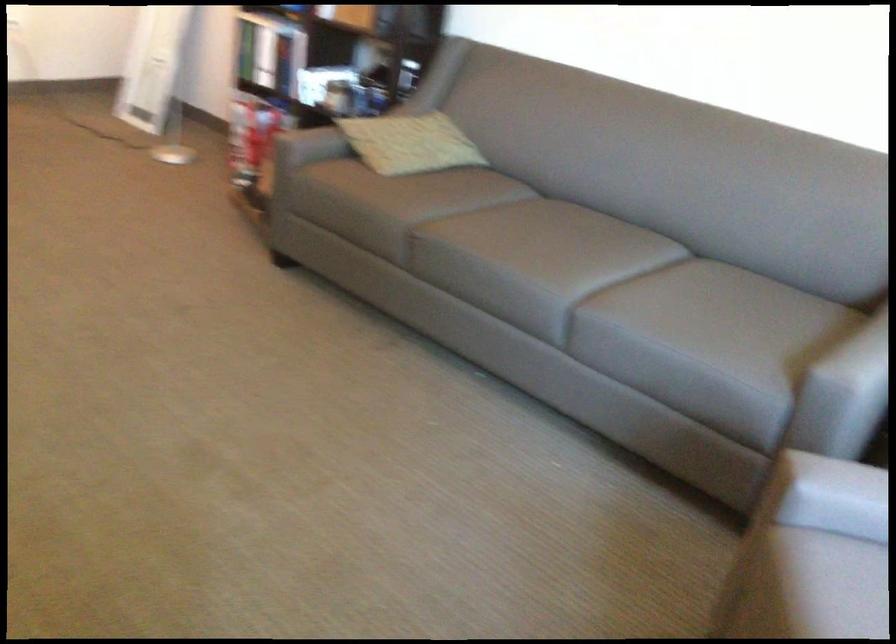
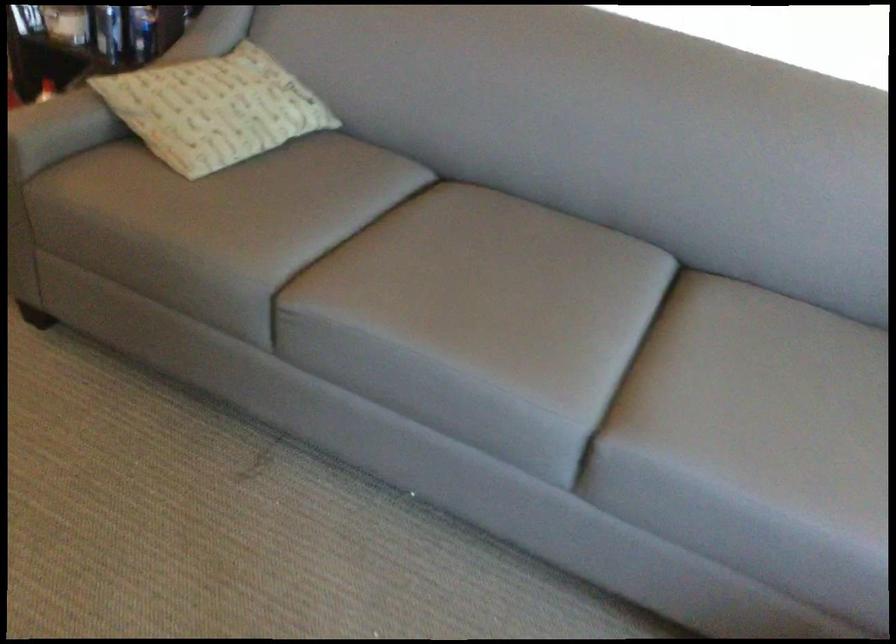
Where in the second image is the point corresponding to point (385, 126) from the first image?

(214, 93)